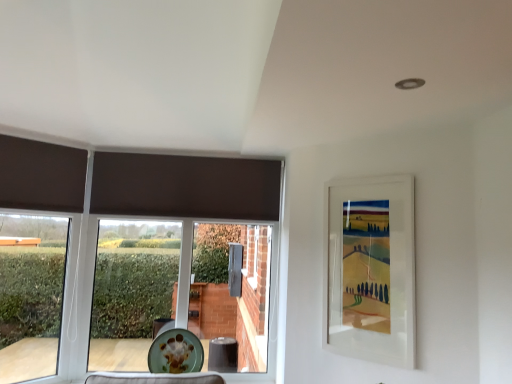
What is the approximate height of green glazed plate at lower center?

green glazed plate at lower center is 31.41 centimeters tall.

Image resolution: width=512 pixels, height=384 pixels. In order to click on white matte picture frame at upper right in this screenshot , I will do `click(370, 269)`.

How many degrees apart are the facing directions of green glazed plate at lower center and white matte picture frame at upper right?

There is a 46.4-degree angle between the facing directions of green glazed plate at lower center and white matte picture frame at upper right.

Could you tell me if green glazed plate at lower center is facing white matte picture frame at upper right?

No, green glazed plate at lower center does not turn towards white matte picture frame at upper right.

Is there a large distance between green glazed plate at lower center and white matte picture frame at upper right?

green glazed plate at lower center is far away from white matte picture frame at upper right.

From the image's perspective, which one is positioned higher, green glazed plate at lower center or white matte picture frame at upper right?

white matte picture frame at upper right, from the image's perspective.

Locate an element on the screen. The width and height of the screenshot is (512, 384). window that appears on the left of green glazed plate at lower center is located at coordinates (31, 294).

From the image's perspective, relative to green glazed plate at lower center, is matte brown curtain at left above or below?

Based on their image positions, matte brown curtain at left is located above green glazed plate at lower center.

How different are the orientations of matte brown curtain at left and green glazed plate at lower center in degrees?

44.7 degrees.

Is matte brown curtain at left looking in the opposite direction of green glazed plate at lower center?

That's not correct — matte brown curtain at left is not looking away from green glazed plate at lower center.

From the picture: Is matte brown curtain at left at the back of green glazed plate at lower center?

That's not correct — green glazed plate at lower center is not looking away from matte brown curtain at left.

Does green glazed plate at lower center have a larger size compared to matte brown curtain at left?

Actually, green glazed plate at lower center might be smaller than matte brown curtain at left.

Would you say green glazed plate at lower center contains matte brown curtain at left?

Actually, matte brown curtain at left is outside green glazed plate at lower center.

From a real-world perspective, does matte brown curtain at left stand above white matte picture frame at upper right?

No.

Considering the sizes of objects matte brown curtain at left and white matte picture frame at upper right in the image provided, who is smaller, matte brown curtain at left or white matte picture frame at upper right?

white matte picture frame at upper right is smaller.

Between matte brown curtain at left and white matte picture frame at upper right, which one has less height?

With less height is white matte picture frame at upper right.

Considering the relative positions of matte brown curtain at left and white matte picture frame at upper right in the image provided, is matte brown curtain at left to the left or to the right of white matte picture frame at upper right?

In the image, matte brown curtain at left appears on the left side of white matte picture frame at upper right.

Is the position of white matte picture frame at upper right less distant than that of matte brown curtain at left?

Yes, it is in front of matte brown curtain at left.

Which of these two, white matte picture frame at upper right or matte brown curtain at left, stands shorter?

white matte picture frame at upper right is shorter.

Which is closer to the camera, (359, 227) or (20, 249)?

Positioned in front is point (359, 227).

From the image's perspective, is white matte picture frame at upper right located beneath matte brown curtain at left?

No, from the image's perspective, white matte picture frame at upper right is not below matte brown curtain at left.

Does white matte picture frame at upper right lie behind green glazed plate at lower center?

No, it is not.

From a real-world perspective, who is located higher, white matte picture frame at upper right or green glazed plate at lower center?

white matte picture frame at upper right, from a real-world perspective.

Between white matte picture frame at upper right and green glazed plate at lower center, which one has more height?

Standing taller between the two is white matte picture frame at upper right.

Identify the location of plate lying behind the white matte picture frame at upper right. The width and height of the screenshot is (512, 384). (175, 352).

Where is `window above the green glazed plate at lower center (from the image's perspective)`? This screenshot has height=384, width=512. window above the green glazed plate at lower center (from the image's perspective) is located at coordinates (31, 294).

Considering their positions, is green glazed plate at lower center positioned further to matte brown curtain at left than white matte picture frame at upper right?

white matte picture frame at upper right.

In the scene shown: Estimate the real-world distances between objects in this image. Which object is further from matte brown curtain at left, white matte picture frame at upper right or green glazed plate at lower center?

white matte picture frame at upper right is positioned further to the anchor matte brown curtain at left.

Estimate the real-world distances between objects in this image. Which object is closer to white matte picture frame at upper right, green glazed plate at lower center or matte brown curtain at left?

green glazed plate at lower center is positioned closer to the anchor white matte picture frame at upper right.

When comparing their distances from green glazed plate at lower center, does matte brown curtain at left or white matte picture frame at upper right seem closer?

matte brown curtain at left.

When comparing their distances from white matte picture frame at upper right, does matte brown curtain at left or green glazed plate at lower center seem closer?

green glazed plate at lower center.

When comparing their distances from green glazed plate at lower center, does white matte picture frame at upper right or matte brown curtain at left seem further?

white matte picture frame at upper right is further to green glazed plate at lower center.

Locate an element on the screen. plate situated between matte brown curtain at left and white matte picture frame at upper right from left to right is located at coordinates (175, 352).